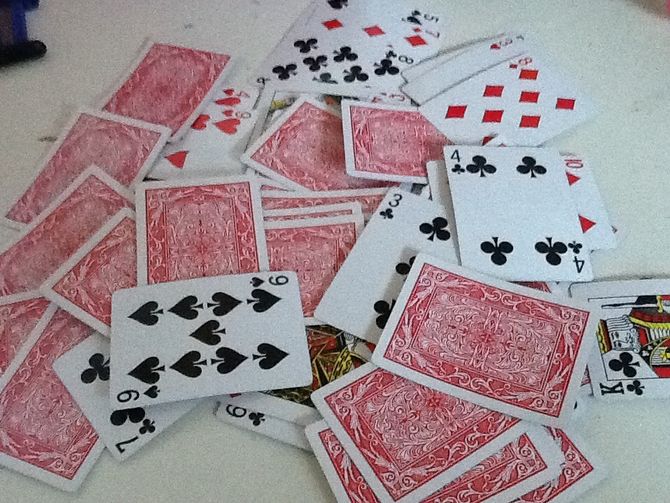
The image size is (670, 503). Find the location of `white table top`. white table top is located at coordinates (70, 82), (630, 189).